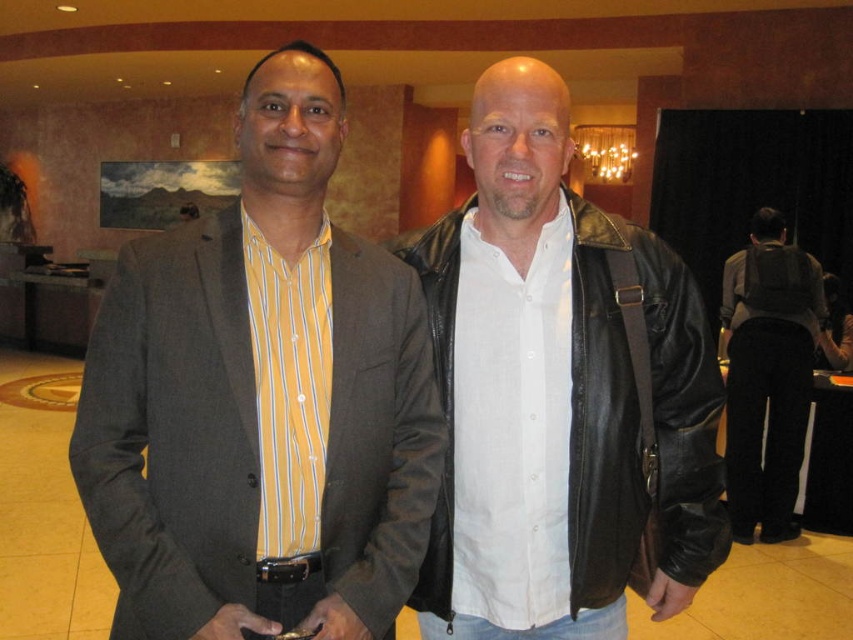
Is matte gray blazer at center bigger than black leather jacket at right?

Actually, matte gray blazer at center might be smaller than black leather jacket at right.

Between matte gray blazer at center and black leather jacket at right, which one has more height?

Standing taller between the two is black leather jacket at right.

Image resolution: width=853 pixels, height=640 pixels. What do you see at coordinates (260, 401) in the screenshot? I see `matte gray blazer at center` at bounding box center [260, 401].

The image size is (853, 640). In order to click on matte gray blazer at center in this screenshot , I will do `click(260, 401)`.

Is black leather jacket at center shorter than black leather jacket at right?

Indeed, black leather jacket at center has a lesser height compared to black leather jacket at right.

Does point (445, 481) come in front of point (792, 298)?

Yes, it is.

Image resolution: width=853 pixels, height=640 pixels. I want to click on black leather jacket at center, so click(601, 426).

Based on the photo, can you confirm if matte gray blazer at center is positioned to the left of black leather jacket at center?

Correct, you'll find matte gray blazer at center to the left of black leather jacket at center.

Can you confirm if matte gray blazer at center is positioned to the right of black leather jacket at center?

In fact, matte gray blazer at center is to the left of black leather jacket at center.

Find the location of a particular element. matte gray blazer at center is located at coordinates (260, 401).